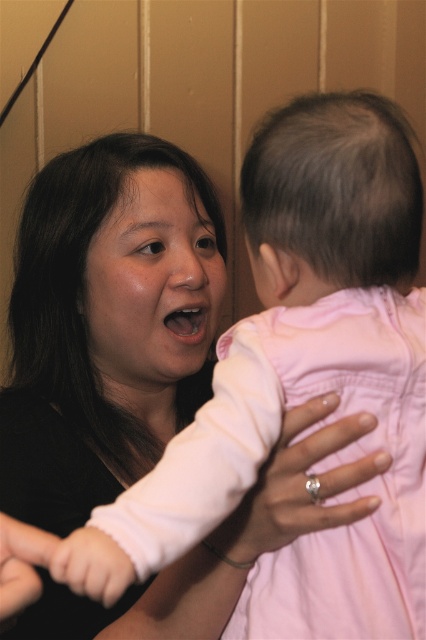
Measure the distance between point (72,541) and camera.

The distance of point (72,541) from camera is 18.73 inches.

Can you confirm if pink fabric baby hand at center is positioned below pink fabric hand at lower left?

Yes.

Image resolution: width=426 pixels, height=640 pixels. In order to click on pink fabric baby hand at center in this screenshot , I will do 92,564.

Between point (259, 525) and point (103, 602), which one is positioned in front?

Point (103, 602) is in front.

Between point (328, 477) and point (129, 566), which one is positioned in front?

Point (129, 566) is more forward.

I want to click on pink fabric hand at center, so click(x=299, y=484).

Measure the distance between pink fabric arm at center and camera.

pink fabric arm at center and camera are 22.42 inches apart.

Is pink fabric arm at center closer to the viewer compared to pink fabric hand at lower left?

No.

Identify the location of pink fabric arm at center. (258, 528).